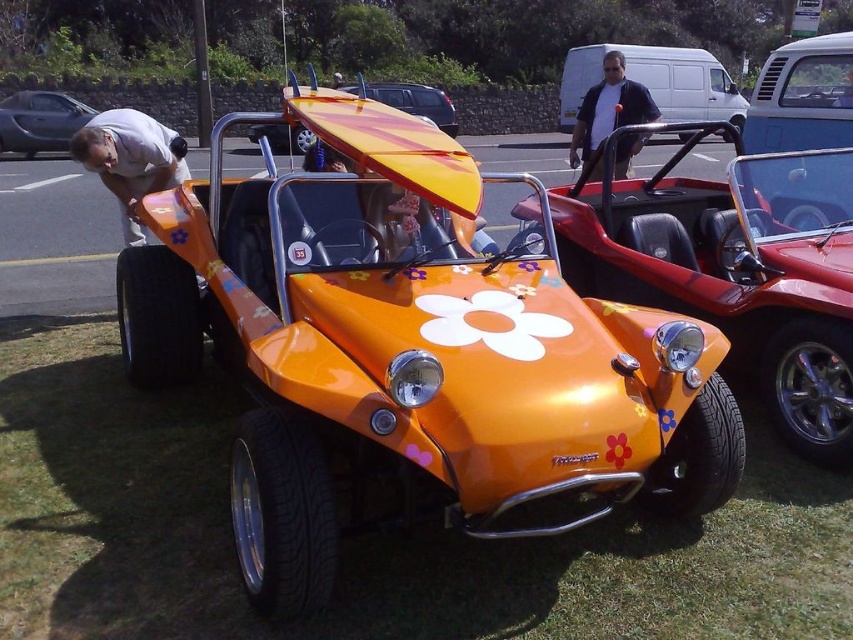
Question: Which object appears closest to the camera in this image?

Choices:
 (A) matte black car at left
 (B) dark blue jacket at upper center

Answer: (B)

Question: Which object is positioned farthest from the orange matte surfboard at center?

Choices:
 (A) matte blue van at upper right
 (B) matte black car at left
 (C) white fabric shirt at left

Answer: (B)

Question: Can you confirm if dark blue jacket at upper center is positioned below yellow matte surfboard at center?

Choices:
 (A) yes
 (B) no

Answer: (A)

Question: Observing the image, what is the correct spatial positioning of orange matte surfboard at center in reference to dark blue jacket at upper center?

Choices:
 (A) below
 (B) above

Answer: (A)

Question: Observing the image, what is the correct spatial positioning of orange matte grass at lower left in reference to matte black car at left?

Choices:
 (A) below
 (B) above

Answer: (A)

Question: Which point is closer to the camera taking this photo?

Choices:
 (A) (705, 240)
 (B) (387, 102)
 (C) (581, 113)
 (D) (90, 116)

Answer: (A)